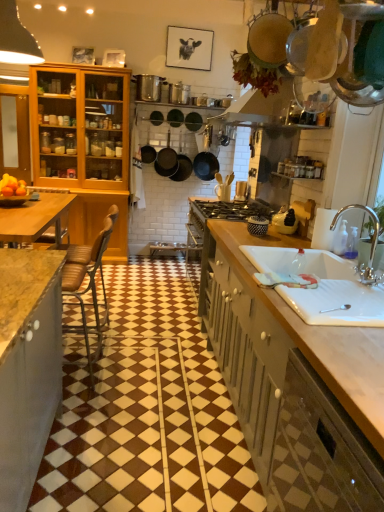
Question: In the image, is silver metallic faucet at sink right positioned in front of or behind matte wooden cabinet at left, which appears as the 3th cabinetry when viewed from the right?

Choices:
 (A) behind
 (B) front

Answer: (B)

Question: Is silver metallic faucet at sink right inside or outside of matte wooden cabinet at left, the third cabinetry ordered from the bottom?

Choices:
 (A) inside
 (B) outside

Answer: (B)

Question: Which object is positioned farthest from the matte wooden cabinet at left, the first cabinetry viewed from the top?

Choices:
 (A) silver metallic faucet at sink right
 (B) white ceramic sink at lower right
 (C) wooden countertop at right, marked as the second cabinetry in a back-to-front arrangement
 (D) green matte cabinet at lower right, the third cabinetry in the left-to-right sequence
 (E) brown leather chair at left

Answer: (D)

Question: Which object is positioned closest to the matte wooden cabinet at left, which appears as the 3th cabinetry when viewed from the right?

Choices:
 (A) white ceramic sink at lower right
 (B) matte black frying pan at center
 (C) green matte cabinet at lower right, which appears as the first cabinetry when viewed from the right
 (D) brown leather chair at left
 (E) wooden countertop at right, which is the second cabinetry in right-to-left order

Answer: (D)